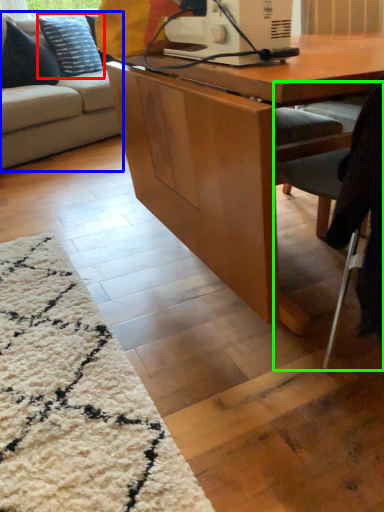
Question: Considering the real-world distances, which object is farthest from pillow (highlighted by a red box)? studio couch (highlighted by a blue box) or chair (highlighted by a green box)?

Choices:
 (A) studio couch
 (B) chair

Answer: (B)